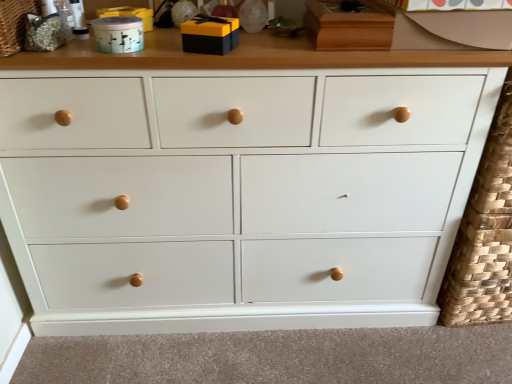
Question: Is matte teal ceramic container at upper left, placed as the second toy when sorted from right to left, inside textured woven basket at upper left?

Choices:
 (A) no
 (B) yes

Answer: (A)

Question: Is textured woven basket at upper left further to the viewer compared to matte teal ceramic container at upper left, placed as the second toy when sorted from right to left?

Choices:
 (A) no
 (B) yes

Answer: (A)

Question: Considering the relative sizes of textured woven basket at upper left and matte teal ceramic container at upper left, acting as the first toy starting from the left, in the image provided, is textured woven basket at upper left shorter than matte teal ceramic container at upper left, acting as the first toy starting from the left,?

Choices:
 (A) no
 (B) yes

Answer: (A)

Question: Is textured woven basket at upper left directly adjacent to matte teal ceramic container at upper left, acting as the first toy starting from the left?

Choices:
 (A) no
 (B) yes

Answer: (A)

Question: From a real-world perspective, is textured woven basket at upper left over matte teal ceramic container at upper left, acting as the first toy starting from the left?

Choices:
 (A) no
 (B) yes

Answer: (B)

Question: Can you confirm if textured woven basket at upper left is positioned to the left of matte teal ceramic container at upper left, placed as the second toy when sorted from right to left?

Choices:
 (A) yes
 (B) no

Answer: (A)

Question: Can you confirm if white painted wood chest of drawers at center is thinner than matte black gift box at upper center, which appears as the 1th toy when viewed from the right?

Choices:
 (A) yes
 (B) no

Answer: (B)

Question: Is white painted wood chest of drawers at center bigger than matte black gift box at upper center, which appears as the 1th toy when viewed from the right?

Choices:
 (A) yes
 (B) no

Answer: (A)

Question: From a real-world perspective, is white painted wood chest of drawers at center positioned over matte black gift box at upper center, acting as the second toy starting from the left, based on gravity?

Choices:
 (A) no
 (B) yes

Answer: (A)

Question: Can you confirm if white painted wood chest of drawers at center is positioned to the right of matte black gift box at upper center, which appears as the 1th toy when viewed from the right?

Choices:
 (A) yes
 (B) no

Answer: (A)

Question: Is the position of white painted wood chest of drawers at center less distant than that of matte black gift box at upper center, which appears as the 1th toy when viewed from the right?

Choices:
 (A) yes
 (B) no

Answer: (B)

Question: Is white painted wood chest of drawers at center directly adjacent to matte black gift box at upper center, acting as the second toy starting from the left?

Choices:
 (A) yes
 (B) no

Answer: (B)

Question: Would you consider textured woven basket at upper left to be distant from matte black gift box at upper center, which appears as the 1th toy when viewed from the right?

Choices:
 (A) yes
 (B) no

Answer: (B)